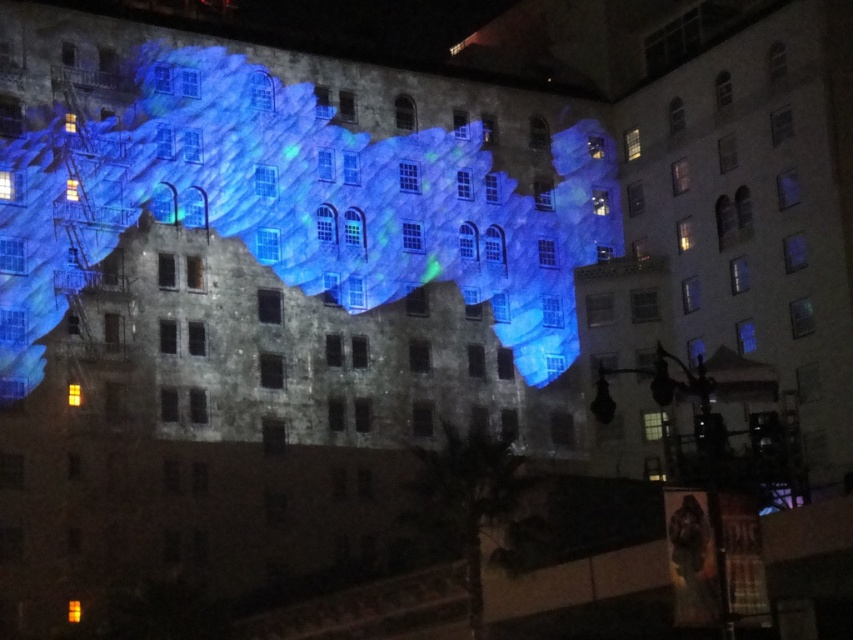
Question: Where is yellow matte light at center located in relation to orange matte light at lower left in the image?

Choices:
 (A) left
 (B) right

Answer: (A)

Question: Among these objects, which one is farthest from the camera?

Choices:
 (A) yellow matte light at center
 (B) orange matte light at lower left

Answer: (A)

Question: Among these points, which one is nearest to the camera?

Choices:
 (A) (71, 396)
 (B) (74, 620)

Answer: (B)

Question: Does yellow matte light at center appear on the left side of orange matte light at lower left?

Choices:
 (A) yes
 (B) no

Answer: (A)

Question: Which of the following is the closest to the observer?

Choices:
 (A) yellow matte light at center
 (B) orange matte light at lower left

Answer: (B)

Question: Does yellow matte light at center appear on the right side of orange matte light at lower left?

Choices:
 (A) yes
 (B) no

Answer: (B)